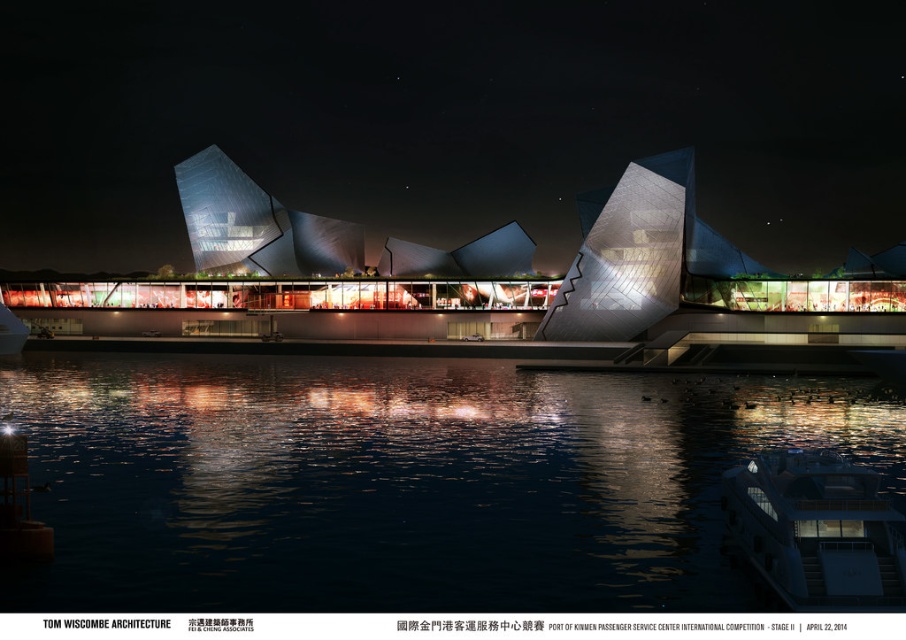
You are a tour guide explaining the layout of the futuristic city to visitors. You mention the sleek glass building at center and the dark reflective water at center. How far apart are these two landmarks in meters?

The sleek glass building at center and the dark reflective water at center are 313.63 feet apart from each other, which converts to approximately 95.6 meters. Therefore, these two landmarks are about 95.6 meters apart.

You are a photographer planning to capture the reflection of the white glossy yacht at lower right in the dark reflective water at center. Will the yacht be fully visible in the water?

The dark reflective water at center is positioned over the white glossy yacht at lower right, so the yacht will not be fully visible in the water as the water is covering it.

You are a photographer planning to capture the reflection of the white glossy yacht at lower right and the sleek glass building at center in the water. Which object will appear closer to the camera in the reflection?

The sleek glass building at center will appear closer to the camera in the reflection because the white glossy yacht at lower right is behind it, so its reflection would be further away.